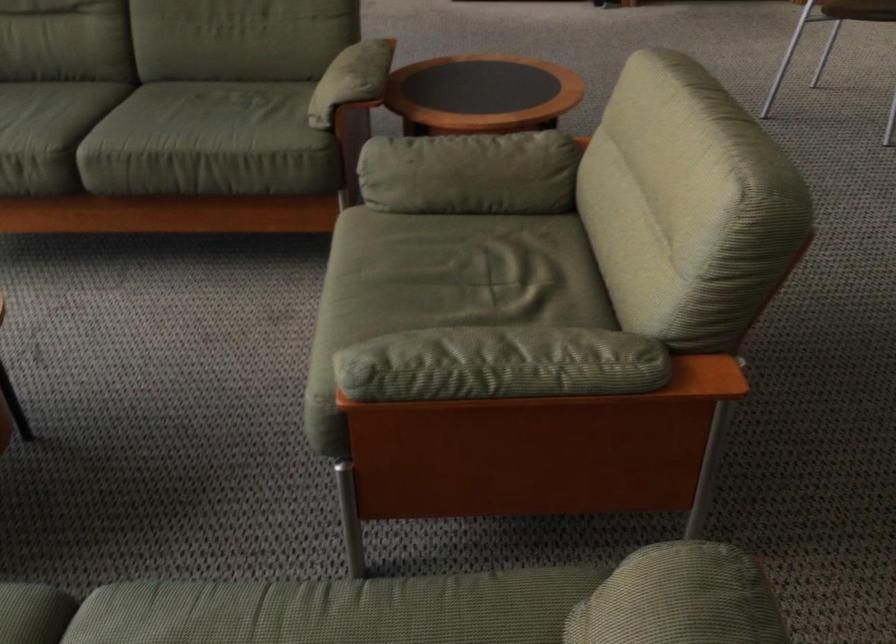
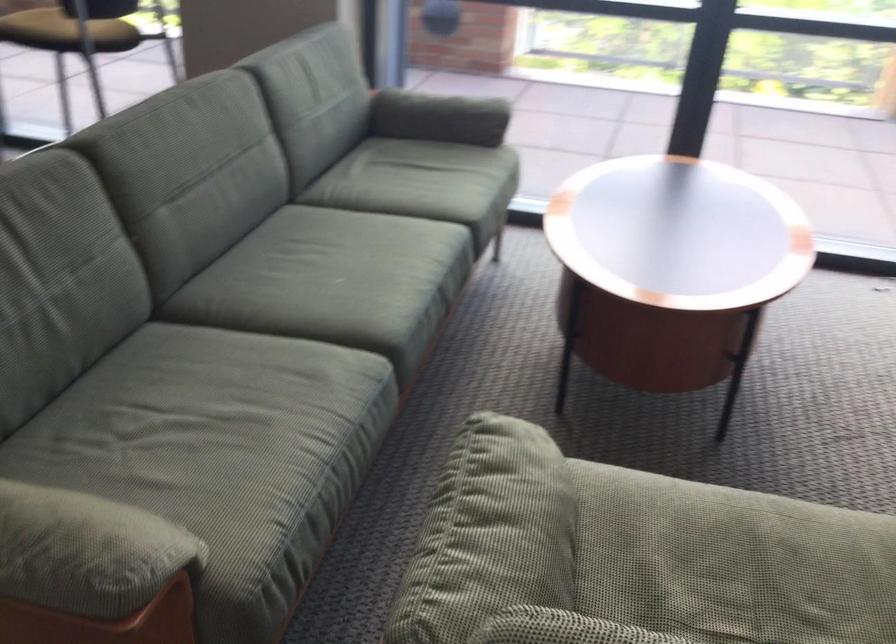
Find the pixel in the second image that matches point (502, 341) in the first image.

(500, 527)